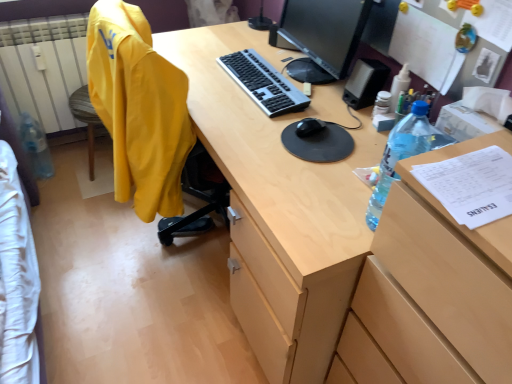
Identify the location of free space between black plastic speaker at upper right and silver/black plastic keyboard at center. The width and height of the screenshot is (512, 384). coord(308,81).